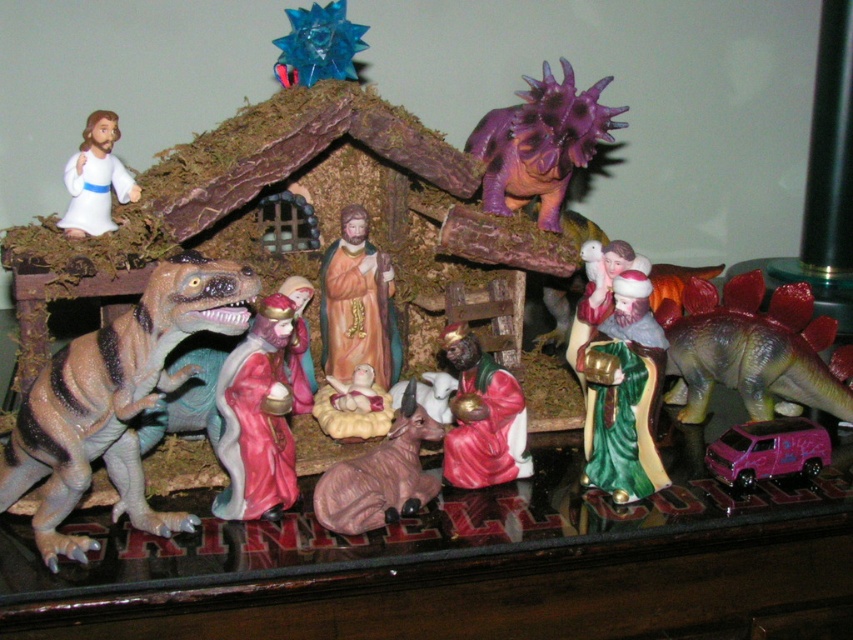
Question: Observing the image, what is the correct spatial positioning of shiny purple dinosaur at right in reference to white plush baby at center?

Choices:
 (A) right
 (B) left

Answer: (A)

Question: Which point is closer to the camera?

Choices:
 (A) (341, 77)
 (B) (357, 387)

Answer: (A)

Question: Is green glossy figurine at center-right in front of matte red figurine at center?

Choices:
 (A) yes
 (B) no

Answer: (A)

Question: Among these objects, which one is farthest from the camera?

Choices:
 (A) pink plastic car at lower right
 (B) shiny purple dinosaur at right

Answer: (B)

Question: Can you confirm if brown textured dinosaur at left is wider than pink matte cow at center?

Choices:
 (A) no
 (B) yes

Answer: (B)

Question: Which point appears closest to the camera in this image?

Choices:
 (A) (463, 417)
 (B) (795, 348)
 (C) (105, 214)

Answer: (A)